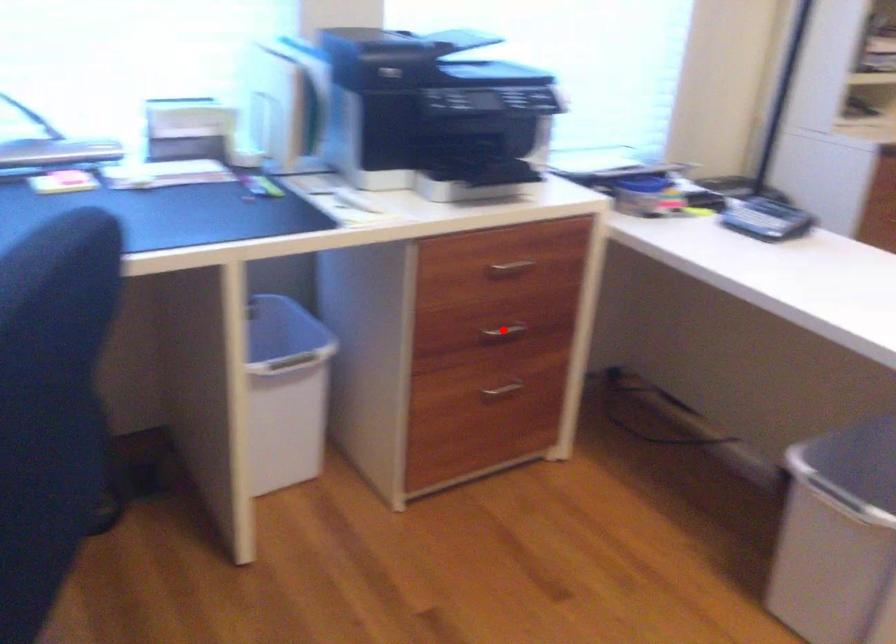
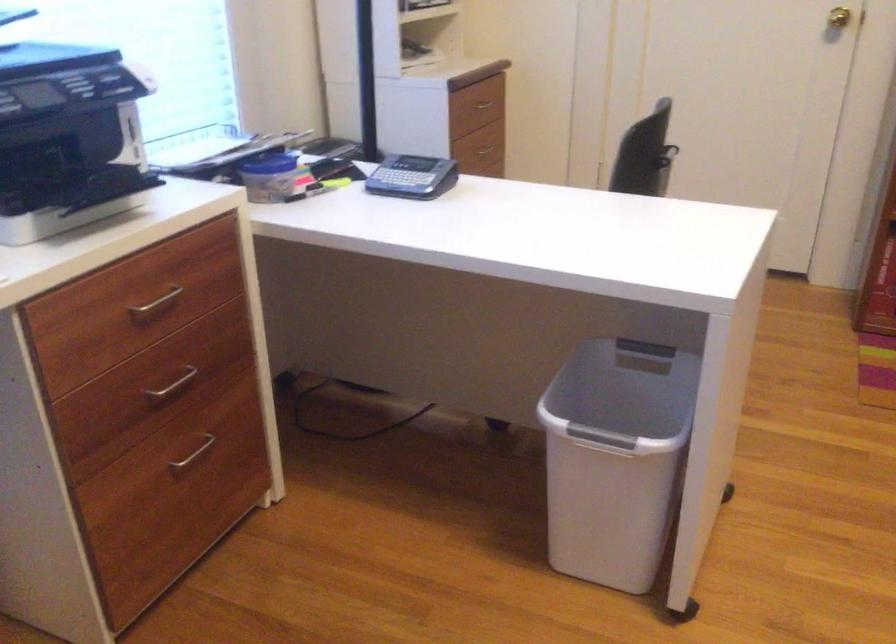
Question: I am providing you with two images of the same scene from different viewpoints. In image1, a red point is highlighted. Considering the same 3D point in image2, which of the following is correct?

Choices:
 (A) It is closer
 (B) It is farther

Answer: (A)